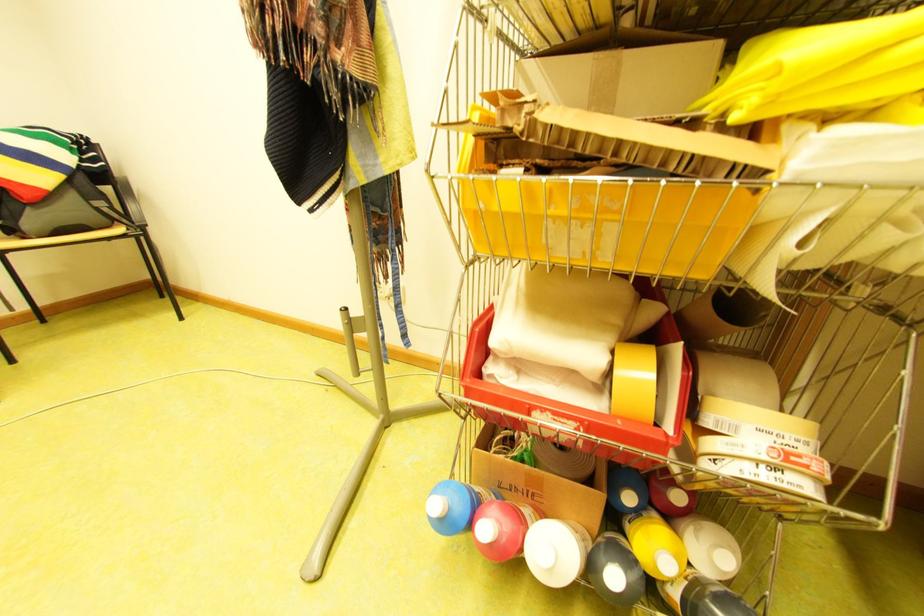
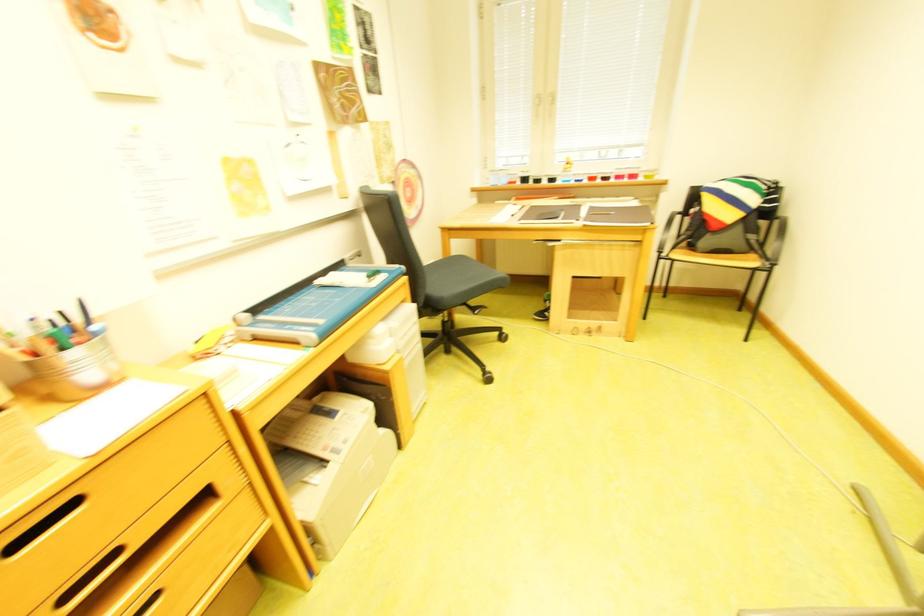
First-person continuous shooting, in which direction is the camera rotating?

The rotation direction of the camera is left-down.